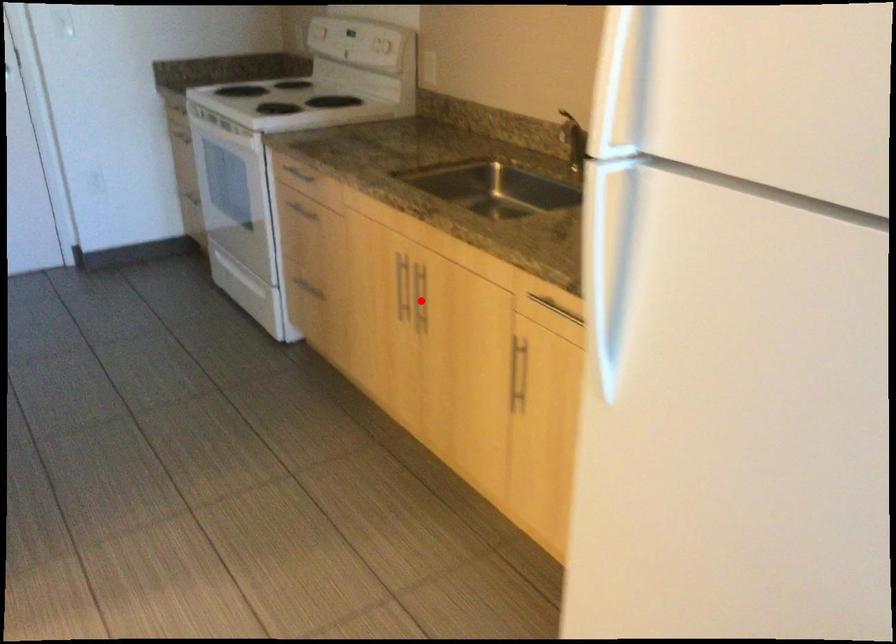
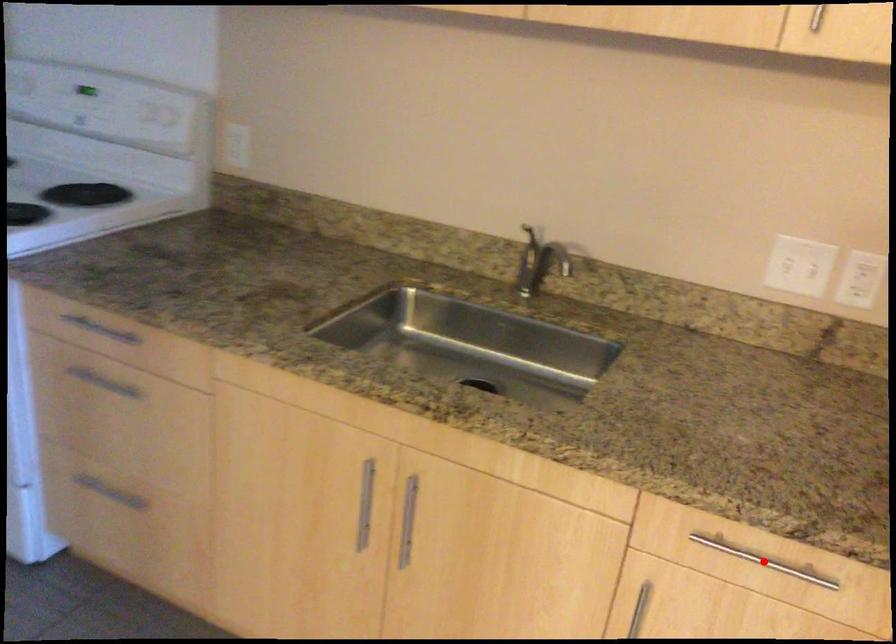
I am providing you with two images of the same scene from different viewpoints. A red point is marked on the first image and another point is marked on the second image. Do the highlighted points in image1 and image2 indicate the same real-world spot?

No